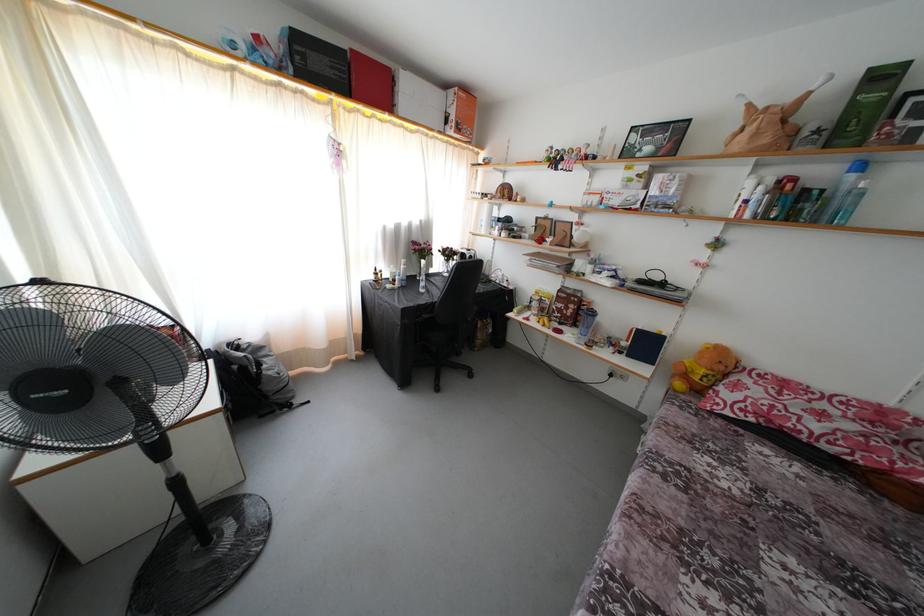
Where would you press the blue spray can? Please return your answer as a coordinate pair (x, y).

(844, 190)